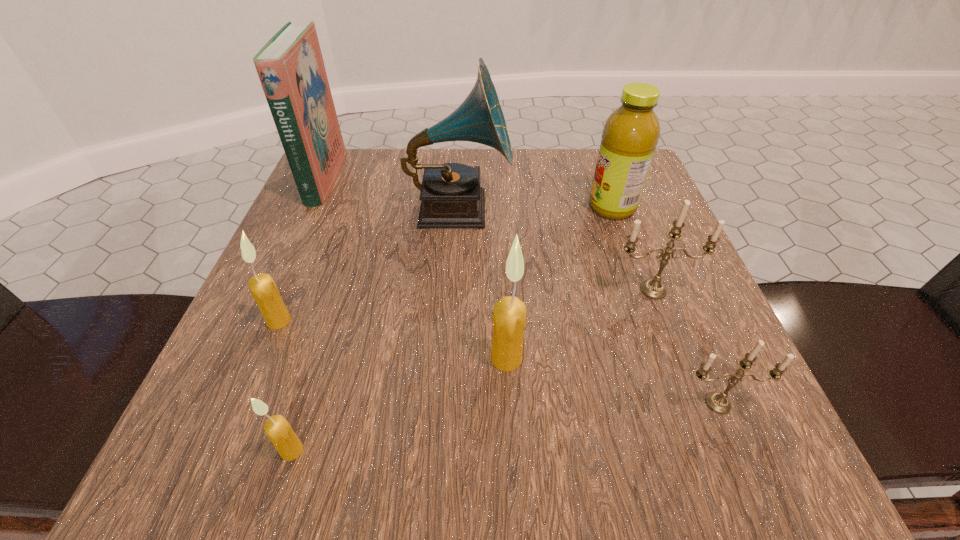
Identify which candle is the third closest to the fruit juice. Please provide its 2D coordinates. Your answer should be formatted as a tuple, i.e. [(x, y)], where the tuple contains the x and y coordinates of a point satisfying the conditions above.

[(718, 402)]

At what (x,y) coordinates should I click in order to perform the action: click on candle that is the third closest to the third candle from left to right. Please return your answer as a coordinate pair (x, y). Image resolution: width=960 pixels, height=540 pixels. Looking at the image, I should click on (278, 430).

At what (x,y) coordinates should I click in order to perform the action: click on cream candle identified as the third closest to the fruit juice. Please return your answer as a coordinate pair (x, y). This screenshot has height=540, width=960. Looking at the image, I should click on coord(278,430).

Identify the location of the second closest cream candle relative to the phonograph_record. (509, 314).

The height and width of the screenshot is (540, 960). I want to click on free space that satisfies the following two spatial constraints: 1. on the cover of the hardback book; 2. on the back side of the third nearest candle, so click(244, 359).

This screenshot has width=960, height=540. In order to click on vacant region that satisfies the following two spatial constraints: 1. on the back side of the tallest candle; 2. from the horn of the phonograph_record in this screenshot , I will do `click(499, 209)`.

Locate an element on the screen. The height and width of the screenshot is (540, 960). free space in the image that satisfies the following two spatial constraints: 1. from the horn of the phonograph_record; 2. on the back side of the tallest candle is located at coordinates (450, 359).

At what (x,y) coordinates should I click in order to perform the action: click on free space in the image that satisfies the following two spatial constraints: 1. on the front label of the nearer metallic candle; 2. on the right side of the fruit juice. Please return your answer as a coordinate pair (x, y). The width and height of the screenshot is (960, 540). Looking at the image, I should click on (682, 403).

I want to click on vacant space that satisfies the following two spatial constraints: 1. on the back side of the third candle from left to right; 2. on the right side of the second candle from left to right, so click(320, 359).

Where is `vacant space that satisfies the following two spatial constraints: 1. from the horn of the phonograph_record; 2. on the left side of the biggest cream candle`? vacant space that satisfies the following two spatial constraints: 1. from the horn of the phonograph_record; 2. on the left side of the biggest cream candle is located at coordinates (450, 359).